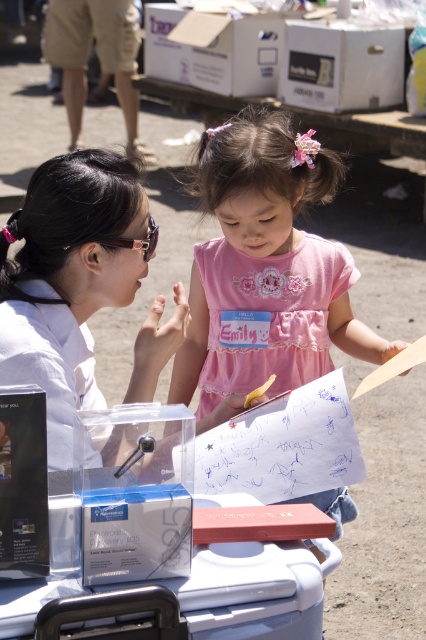
Can you confirm if pink satin dress at center is smaller than matte black goggles at upper left?

No.

Can you confirm if pink satin dress at center is thinner than matte black goggles at upper left?

In fact, pink satin dress at center might be wider than matte black goggles at upper left.

Describe the element at coordinates (265, 268) in the screenshot. I see `pink satin dress at center` at that location.

You are a GUI agent. You are given a task and a screenshot of the screen. Output one action in this format:
    pyautogui.click(x=<x>, y=<y>)
    Task: Click on the pink satin dress at center
    
    Given the screenshot: What is the action you would take?
    pyautogui.click(x=265, y=268)